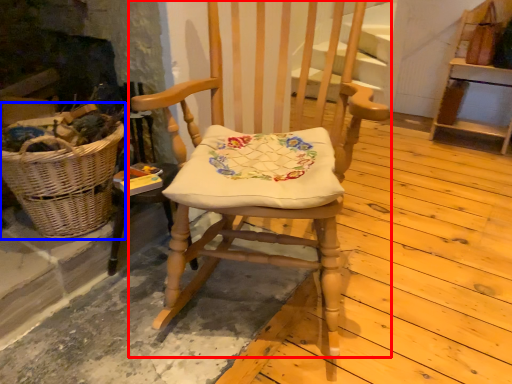
Question: Which object is closer to the camera taking this photo, chair (highlighted by a red box) or picnic basket (highlighted by a blue box)?

Choices:
 (A) chair
 (B) picnic basket

Answer: (A)